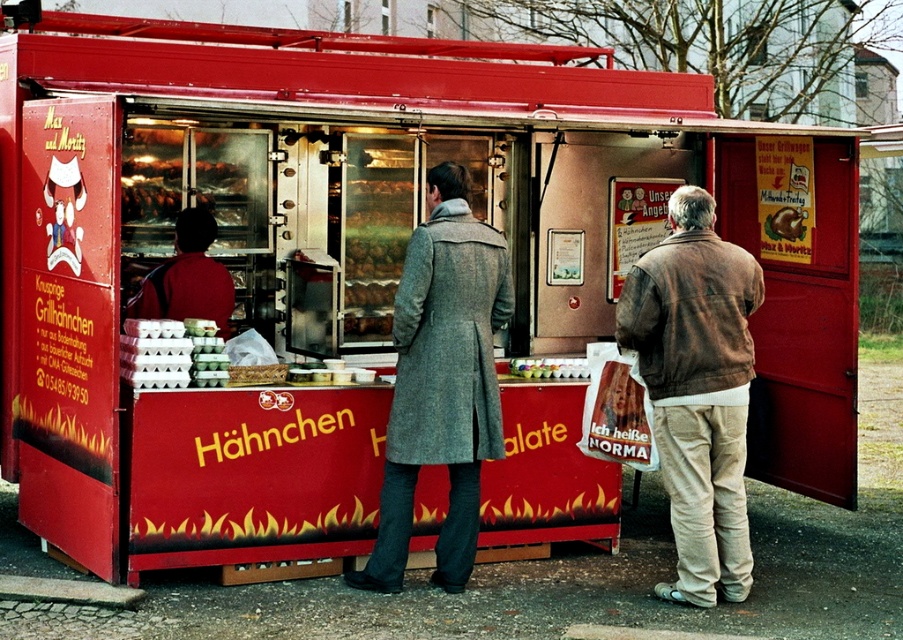
Question: Can you confirm if matte red jacket at center is bigger than matte plastic cups at center?

Choices:
 (A) yes
 (B) no

Answer: (A)

Question: Which point is farther from the camera taking this photo?

Choices:
 (A) (213, 234)
 (B) (793, 237)
 (C) (540, 360)

Answer: (B)

Question: Can you confirm if matte red jacket at center is positioned to the left of smooth chocolate bar at center?

Choices:
 (A) no
 (B) yes

Answer: (B)

Question: Which object is the closest to the matte red jacket at center?

Choices:
 (A) matte plastic cups at center
 (B) gray wool coat at center
 (C) brown leather jacket at right
 (D) smooth chocolate bar at center

Answer: (B)

Question: Can you confirm if gray wool coat at center is positioned to the right of matte plastic cups at center?

Choices:
 (A) yes
 (B) no

Answer: (B)

Question: Which point appears closest to the camera in this image?

Choices:
 (A) (438, 438)
 (B) (557, 368)
 (C) (792, 221)
 (D) (224, 282)

Answer: (A)